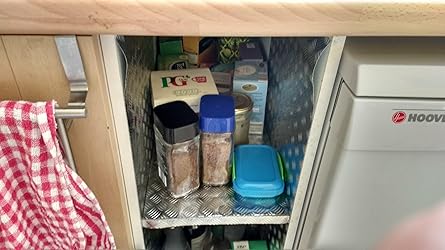
The width and height of the screenshot is (445, 250). Find the location of `trim`. trim is located at coordinates (75, 15), (99, 15), (351, 20).